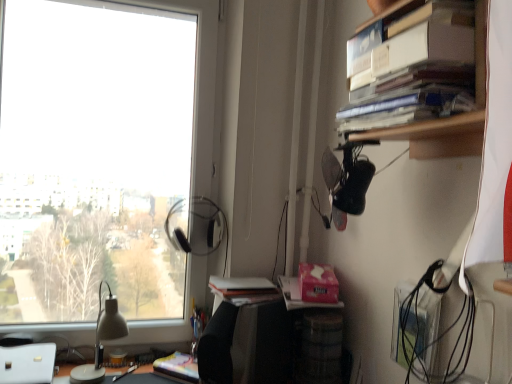
Find the location of a particular element. The width and height of the screenshot is (512, 384). free space above multicolored paper at lower center (from a real-world perspective) is located at coordinates (183, 361).